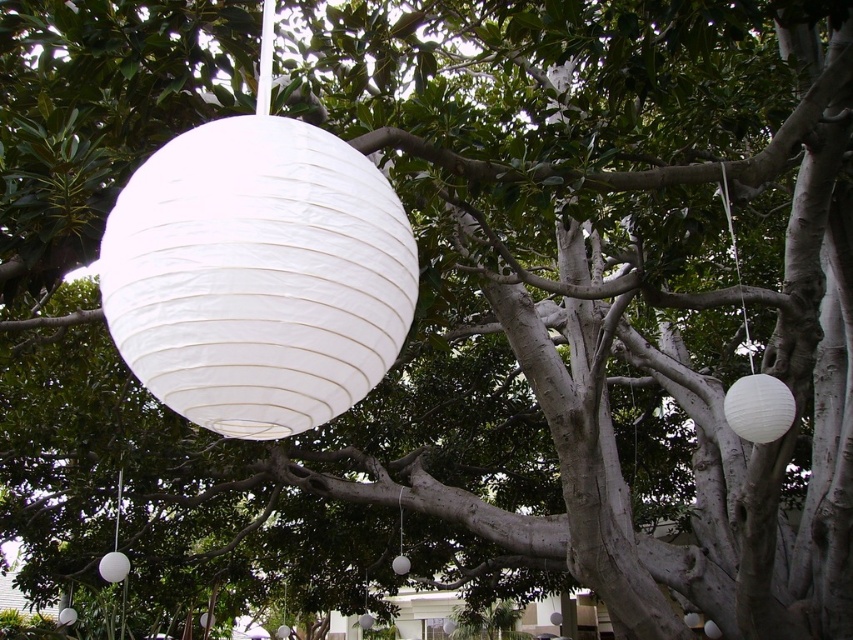
Question: Based on their relative distances, which object is nearer to the white paper lantern at upper right?

Choices:
 (A) white paper lantern at upper center
 (B) white paper lantern at right
 (C) white paper lantern at lower center
 (D) white paper lantern at lower left

Answer: (B)

Question: Which of these objects is positioned farthest from the white paper lantern at lower left?

Choices:
 (A) white paper lantern at upper center
 (B) white paper lantern at lower center
 (C) white paper lantern at right
 (D) white paper lantern at center

Answer: (A)

Question: Is the position of white paper lantern at right less distant than that of white paper lantern at lower center?

Choices:
 (A) yes
 (B) no

Answer: (A)

Question: Can you confirm if white paper lamp at lower left is positioned to the right of white paper lantern at center?

Choices:
 (A) no
 (B) yes

Answer: (A)

Question: Observing the image, what is the correct spatial positioning of white paper lantern at upper right in reference to white paper lamp at lower left?

Choices:
 (A) left
 (B) right

Answer: (B)

Question: Which of the following is the closest to the observer?

Choices:
 (A) white paper lantern at center
 (B) white paper lantern at lower center
 (C) white paper lantern at lower left
 (D) white paper lantern at right

Answer: (D)